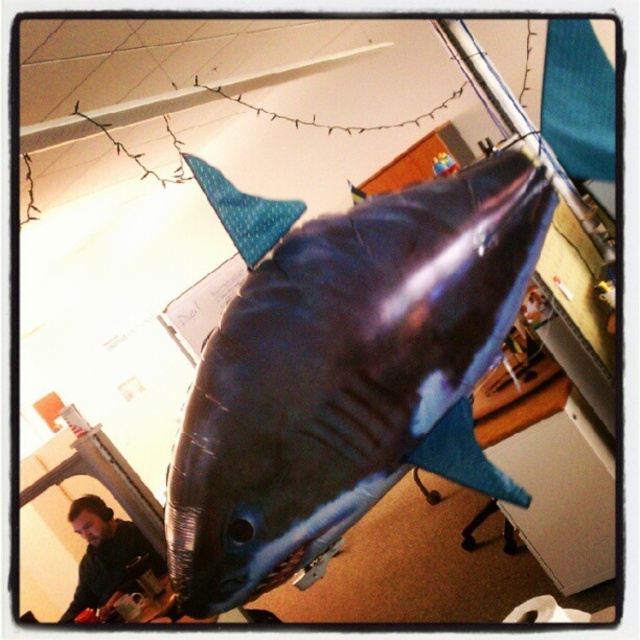
Looking at this image, is the position of shiny metallic shark at center less distant than that of black matte shirt at lower left?

That is True.

Who is more distant from viewer, (369, 506) or (97, 532)?

The point (97, 532) is behind.

Where is `shiny metallic shark at center`? Image resolution: width=640 pixels, height=640 pixels. shiny metallic shark at center is located at coordinates (346, 372).

Does black matte shirt at lower left have a greater height compared to blue dotted fabric fin at upper center?

Yes, black matte shirt at lower left is taller than blue dotted fabric fin at upper center.

Can you confirm if black matte shirt at lower left is thinner than blue dotted fabric fin at upper center?

No.

This screenshot has height=640, width=640. What do you see at coordinates (106, 557) in the screenshot? I see `black matte shirt at lower left` at bounding box center [106, 557].

Locate an element on the screen. The image size is (640, 640). black matte shirt at lower left is located at coordinates (106, 557).

Is point (362, 305) closer to camera compared to point (276, 241)?

Yes, it is in front of point (276, 241).

The image size is (640, 640). Identify the location of shiny metallic shark at center. (346, 372).